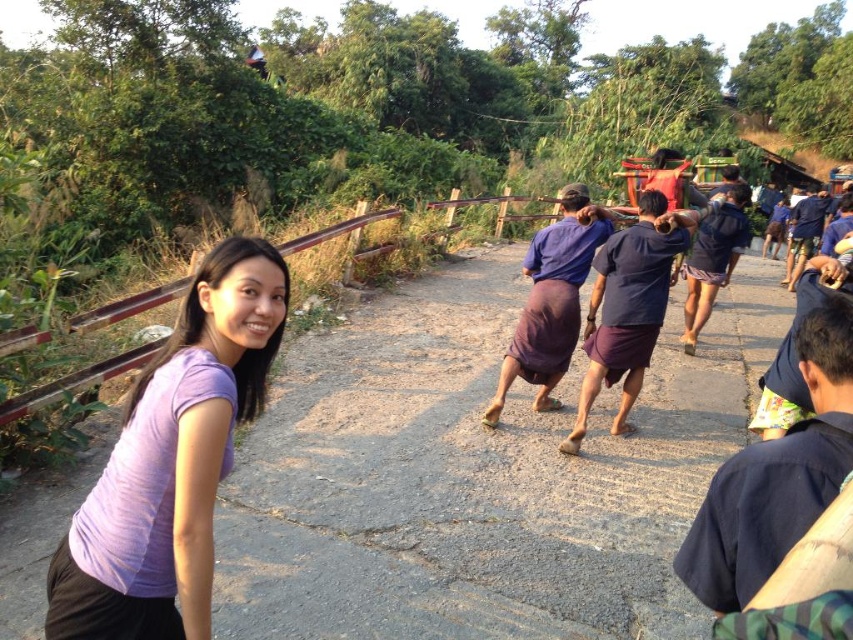
Does purple fabric at center have a larger size compared to purple cotton shirt at center?

Actually, purple fabric at center might be smaller than purple cotton shirt at center.

Between point (654, 412) and point (654, 202), which one is positioned in front?

Point (654, 202)

Measure the distance between point (x=741, y=323) and camera.

The distance of point (x=741, y=323) from camera is 8.35 meters.

I want to click on purple fabric at center, so click(476, 476).

Does purple matte shirt at lower left have a lesser width compared to purple cotton skirt at center?

Yes, purple matte shirt at lower left is thinner than purple cotton skirt at center.

Measure the distance between purple matte shirt at lower left and camera.

purple matte shirt at lower left is 4.52 feet from camera.

Measure the distance between point (166,547) and camera.

Point (166,547) and camera are 1.49 meters apart from each other.

Find the location of a particular element. purple matte shirt at lower left is located at coordinates (172, 461).

Which is behind, point (628, 385) or point (520, 342)?

Point (520, 342)

Measure the distance between point (619, 236) and camera.

The distance of point (619, 236) from camera is 4.42 meters.

The height and width of the screenshot is (640, 853). Find the location of `purple cotton shirt at center`. purple cotton shirt at center is located at coordinates (628, 307).